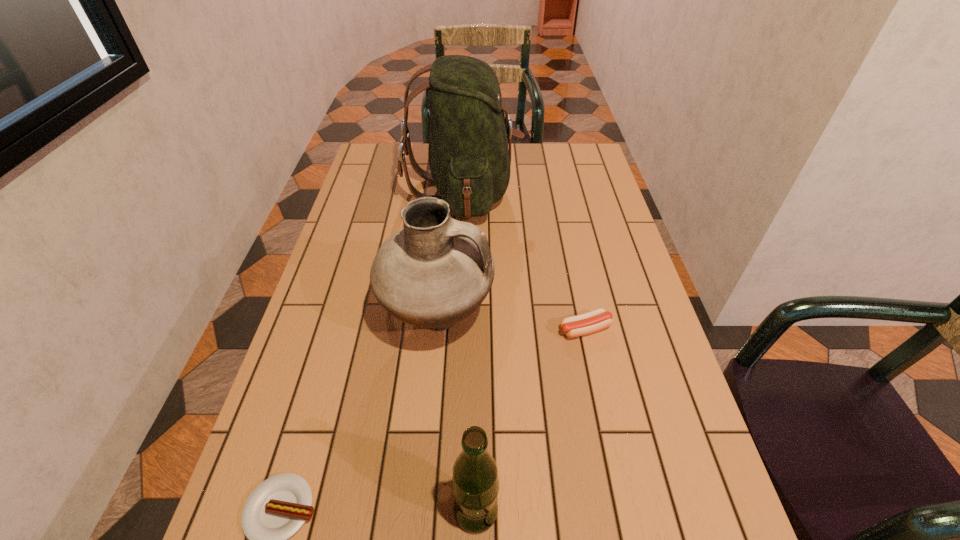
You are a GUI agent. You are given a task and a screenshot of the screen. Output one action in this format:
    pyautogui.click(x=<x>, y=<y>)
    Task: Click on the free space between the third tallest object and the second tallest object
    
    Given the screenshot: What is the action you would take?
    pyautogui.click(x=457, y=415)

Image resolution: width=960 pixels, height=540 pixels. Identify the location of object that is the second closest to the third tallest object. (436, 271).

Identify which object is the nearest to the beer bottle. Please provide its 2D coordinates. Your answer should be formatted as a tuple, i.e. [(x, y)], where the tuple contains the x and y coordinates of a point satisfying the conditions above.

[(277, 508)]

You are a GUI agent. You are given a task and a screenshot of the screen. Output one action in this format:
    pyautogui.click(x=<x>, y=<y>)
    Task: Click on the vacant space that satisfies the following two spatial constraints: 1. on the back side of the second shortest object; 2. on the right side of the third shortest object
    This screenshot has height=540, width=960.
    Given the screenshot: What is the action you would take?
    pyautogui.click(x=477, y=329)

This screenshot has height=540, width=960. What are the coordinates of `free space in the image that satisfies the following two spatial constraints: 1. on the back side of the right sausage; 2. on the left side of the third shortest object` in the screenshot? It's located at (477, 329).

Image resolution: width=960 pixels, height=540 pixels. In order to click on vacant space that satisfies the following two spatial constraints: 1. on the handle side of the third tallest object; 2. on the right side of the pitcher in this screenshot , I will do `click(421, 511)`.

In order to click on blank space that satisfies the following two spatial constraints: 1. on the open flap of the farthest object; 2. on the left side of the taller sausage in this screenshot , I will do `click(457, 329)`.

Where is `free region that satisfies the following two spatial constraints: 1. on the handle side of the third shortest object; 2. on the right side of the pitcher`? The height and width of the screenshot is (540, 960). free region that satisfies the following two spatial constraints: 1. on the handle side of the third shortest object; 2. on the right side of the pitcher is located at coordinates (421, 511).

In order to click on free location that satisfies the following two spatial constraints: 1. on the open flap of the tallest object; 2. on the back side of the third shortest object in this screenshot , I will do `click(448, 511)`.

Where is `free space that satisfies the following two spatial constraints: 1. on the back side of the rightmost object; 2. on the open flap of the farthest object`? free space that satisfies the following two spatial constraints: 1. on the back side of the rightmost object; 2. on the open flap of the farthest object is located at coordinates (556, 191).